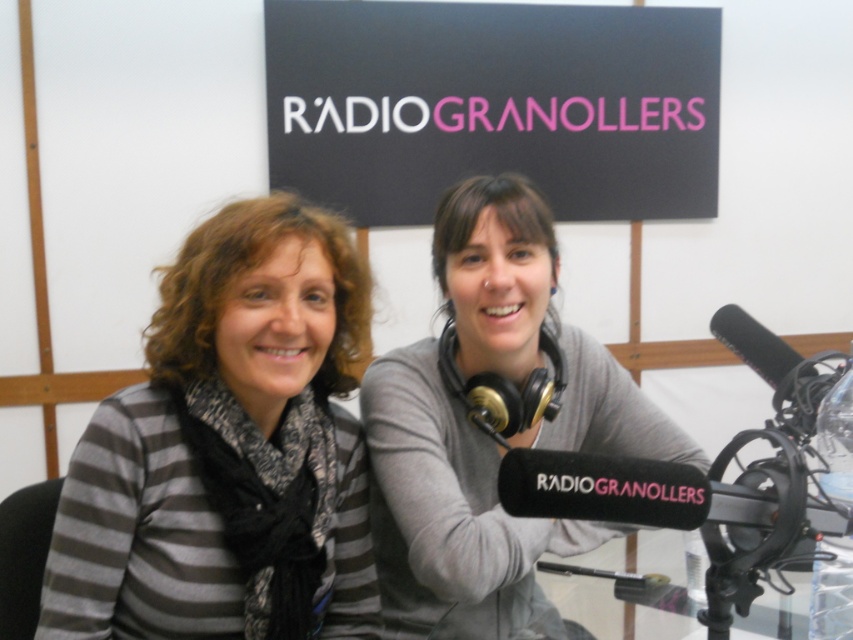
Can you confirm if gray matte headphones at center is taller than black matte microphone at right?

Indeed, gray matte headphones at center has a greater height compared to black matte microphone at right.

Locate an element on the screen. gray matte headphones at center is located at coordinates (486, 433).

Where is `gray matte headphones at center`? This screenshot has height=640, width=853. gray matte headphones at center is located at coordinates (486, 433).

Looking at this image, is striped fabric shirt at left wider than black matte signboard at upper center?

Incorrect, striped fabric shirt at left's width does not surpass black matte signboard at upper center's.

Which is above, striped fabric shirt at left or black matte signboard at upper center?

black matte signboard at upper center

At what (x,y) coordinates should I click in order to perform the action: click on striped fabric shirt at left. Please return your answer as a coordinate pair (x, y). Looking at the image, I should click on (224, 442).

Locate an element on the screen. This screenshot has height=640, width=853. striped fabric shirt at left is located at coordinates (224, 442).

Which is above, black matte signboard at upper center or gray matte headphones at center?

black matte signboard at upper center is above.

Does black matte signboard at upper center lie behind gray matte headphones at center?

Yes, it is behind gray matte headphones at center.

Locate an element on the screen. black matte signboard at upper center is located at coordinates (492, 106).

What are the coordinates of `black matte signboard at upper center` in the screenshot? It's located at (492, 106).